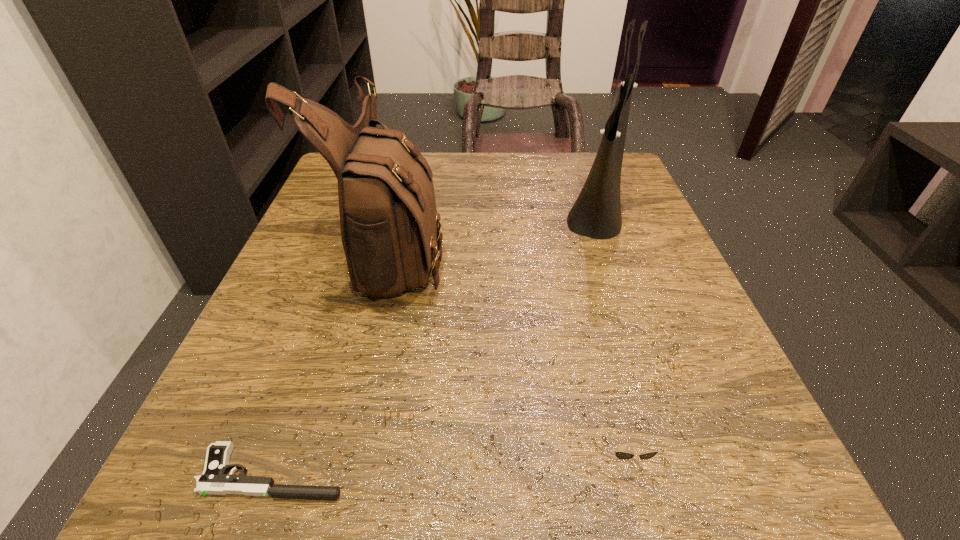
Image resolution: width=960 pixels, height=540 pixels. Find the location of `pistol located at the left edge`. pistol located at the left edge is located at coordinates (214, 480).

Where is `shoulder bag present at the right edge`? This screenshot has height=540, width=960. shoulder bag present at the right edge is located at coordinates (596, 213).

This screenshot has width=960, height=540. I want to click on sunglasses located at the right edge, so click(623, 455).

At what (x,y) coordinates should I click in order to perform the action: click on object situated at the near left corner. Please return your answer as a coordinate pair (x, y). This screenshot has width=960, height=540. Looking at the image, I should click on (214, 480).

This screenshot has width=960, height=540. I want to click on object positioned at the far right corner, so click(x=596, y=213).

At what (x,y) coordinates should I click in order to perform the action: click on object that is positioned at the near right corner. Please return your answer as a coordinate pair (x, y). This screenshot has width=960, height=540. Looking at the image, I should click on (623, 455).

Image resolution: width=960 pixels, height=540 pixels. I want to click on vacant space at the far edge, so click(452, 200).

Image resolution: width=960 pixels, height=540 pixels. I want to click on vacant area at the left edge, so tap(335, 312).

The image size is (960, 540). In the image, there is a desktop. In order to click on vacant space at the right edge in this screenshot , I will do `click(679, 270)`.

Image resolution: width=960 pixels, height=540 pixels. In order to click on free space at the near left corner of the desktop in this screenshot , I will do `click(313, 462)`.